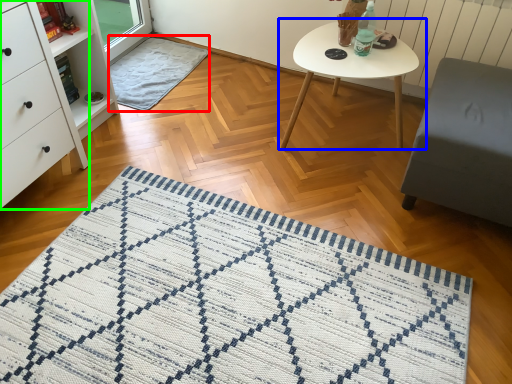
Question: Estimate the real-world distances between objects in this image. Which object is farther from blanket (highlighted by a red box), coffee table (highlighted by a blue box) or chest of drawers (highlighted by a green box)?

Choices:
 (A) coffee table
 (B) chest of drawers

Answer: (A)